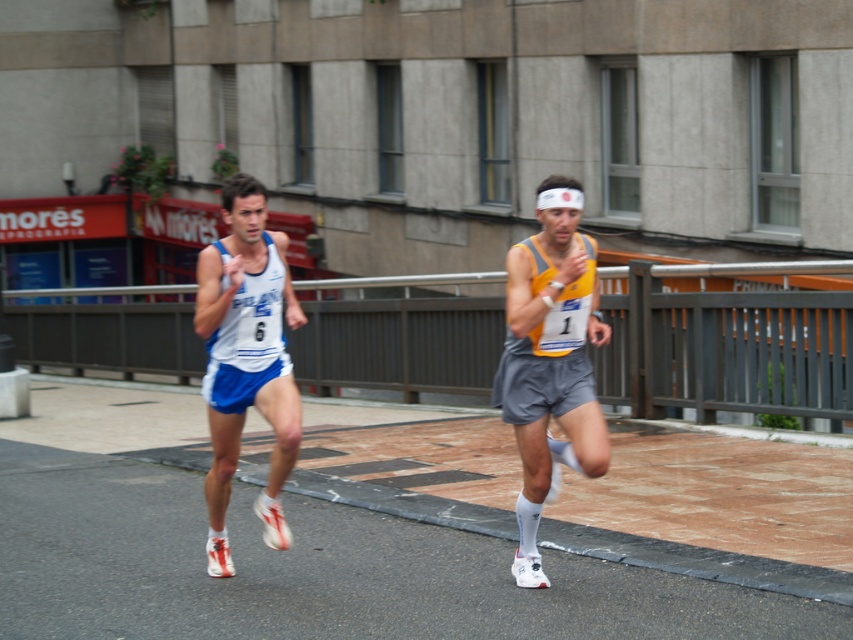
You are a spectator watching the marathon runners. You notice two runners with tank tops of different colors. Which runner, the yellow fabric tank top at center or the white fabric tank top at left, is currently ahead in the race?

The yellow fabric tank top at center is located above the white fabric tank top at left, meaning the yellow runner is ahead in the race.

You are a race official who needs to ensure that runners maintain a minimum distance of 3 feet apart for safety. Based on the image, is the distance between the yellow fabric tank top at center and the white fabric tank top at left compliant with the safety requirement?

The distance between the yellow fabric tank top at center and the white fabric tank top at left is 3.84 feet, which exceeds the required 3 feet minimum distance, so it is compliant with the safety requirement.

Consider the image. You are a photographer standing at the camera position. You want to take a photo of the two runners, but you need to ensure that the focus is sharp for both. Given that your camera has a depth of field that can cover up to 6 meters, will both runners be in focus if you focus on the point at point (519, 532)?

The distance between point (519, 532) and the camera is 7.04 meters. Since the depth of field can only cover up to 6 meters, focusing on point (519, 532) would mean the depth of field extends from approximately 7.04 meters minus 3 meters to 7.04 meters plus 3 meters, but this calculation is incorrect because depth of field doesn t work that way. The actual depth of field depends on factors like aperture and focal length, which aren t provided here. Therefore, it s impossible to determine if both runners